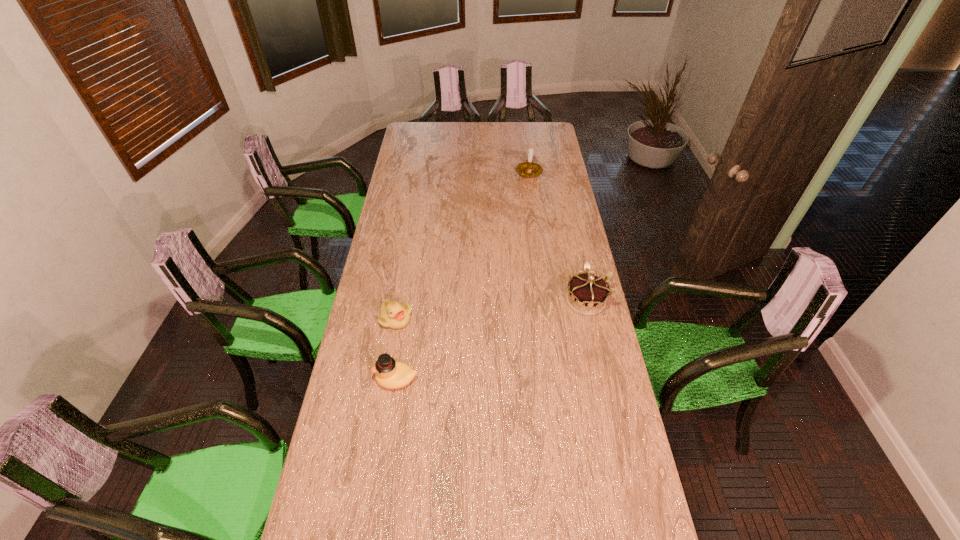
Find the location of `free space on the desktop that is between the duck and the crown and is positioned on the front-facing side of the shortest object`. free space on the desktop that is between the duck and the crown and is positioned on the front-facing side of the shortest object is located at coordinates (470, 349).

Where is `vacant space on the desktop that is between the duck and the crown and is positioned with a handle on the tallest object`? The height and width of the screenshot is (540, 960). vacant space on the desktop that is between the duck and the crown and is positioned with a handle on the tallest object is located at coordinates (525, 326).